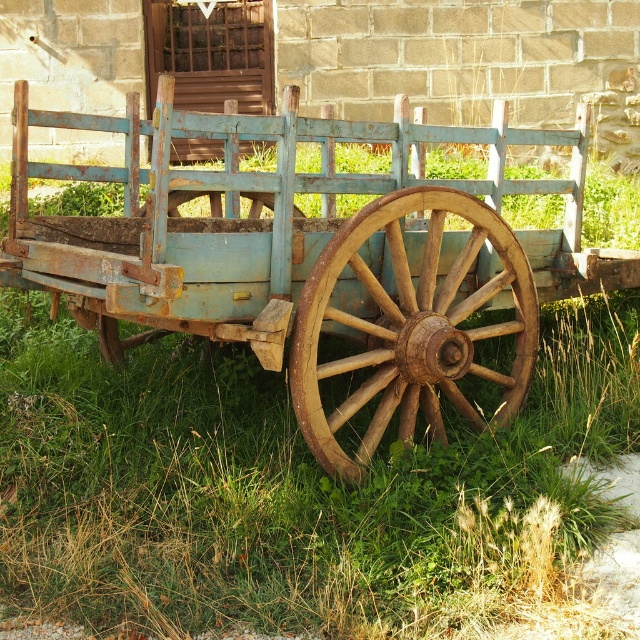
Question: Which object appears closest to the camera in this image?

Choices:
 (A) rusty wood wagon wheel at center
 (B) rusty wood wagon at center

Answer: (B)

Question: Is rusty wood wagon at center below rusty wood wagon wheel at center?

Choices:
 (A) no
 (B) yes

Answer: (A)

Question: Is rusty wood wagon at center smaller than rusty wood wagon wheel at center?

Choices:
 (A) yes
 (B) no

Answer: (B)

Question: Which point is closer to the camera?

Choices:
 (A) (426, 296)
 (B) (524, 305)

Answer: (A)

Question: Where is rusty wood wagon at center located in relation to rusty wood wagon wheel at center in the image?

Choices:
 (A) above
 (B) below

Answer: (A)